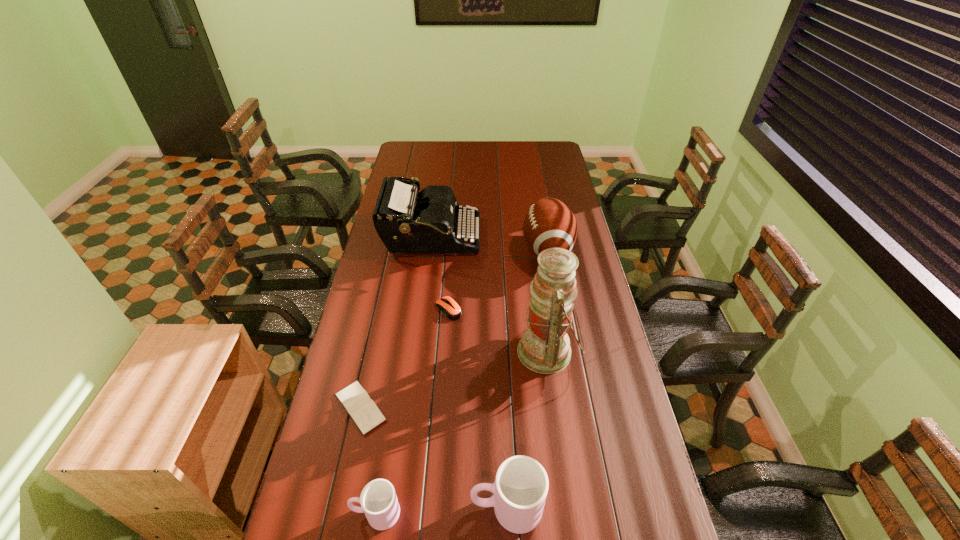
I want to click on vacant place for an extra cup on the right, so click(635, 502).